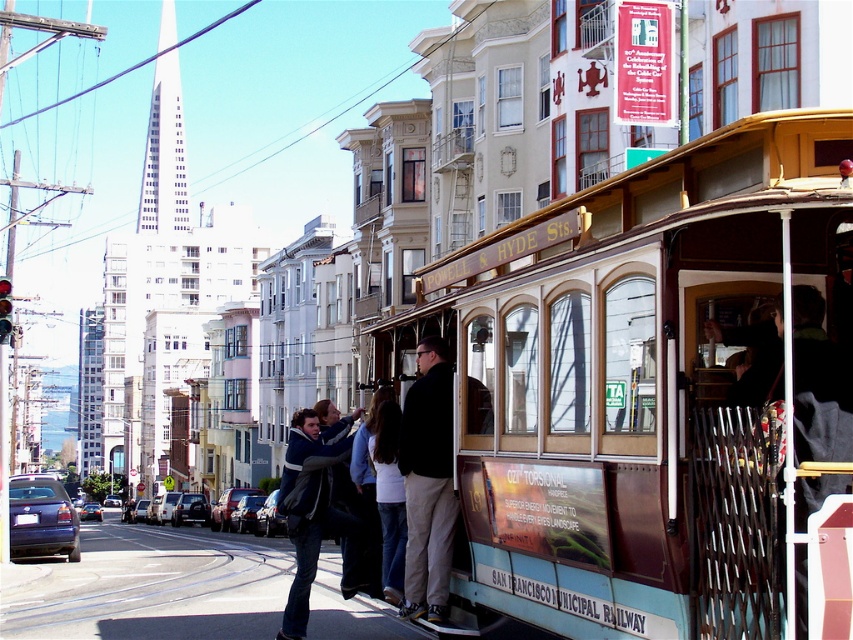
You are standing at the camera position and want to pick up the dark brown leather jacket at center. Is it within your immediate reach?

The dark brown leather jacket at center is 30.73 feet away from the camera, so it is not within immediate reach.

You are standing at point (616, 362) in the image. What object is located exactly at your current position?

The teal polished wood cable car at center is located exactly at point (616, 362).

You are a tailor measuring jackets for alterations. You need to determine if the dark brown leather jacket at center and denim jacket at lower left can be placed side by side on a 2.5 meter long table. Can they fit?

The distance between dark brown leather jacket at center and denim jacket at lower left is 1.18 meters, so yes, they can be placed side by side on a 2.5 meter long table since the combined length of both jackets would be less than 2.5 meters.